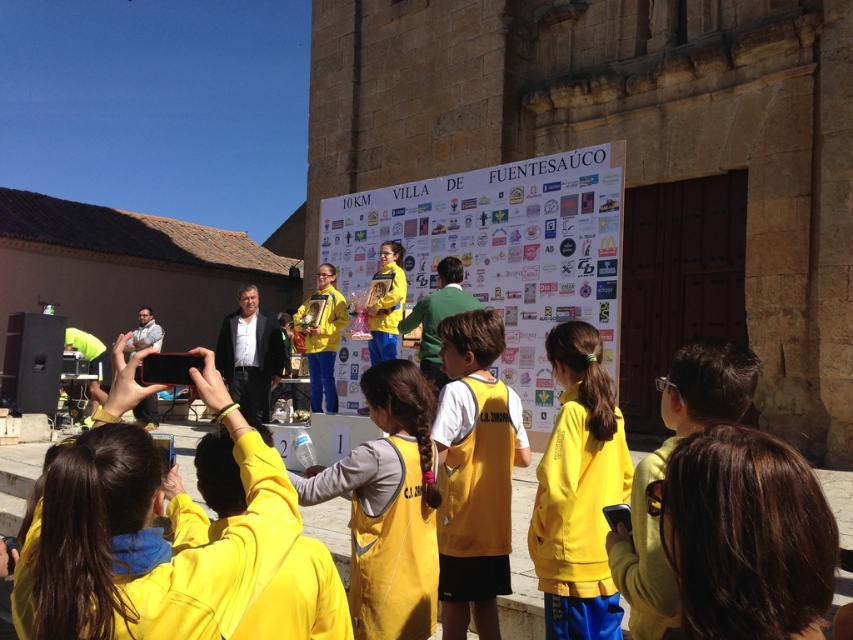
You are a photographer at the event and want to arrange the yellow fabric jacket at center and the yellow matte jacket at center so that both are visible in the photo. Which jacket should be placed in front to ensure the taller one is not blocked?

The yellow fabric jacket at center is not as tall as the yellow matte jacket at center, so to ensure the taller jacket is not blocked, the shorter yellow fabric jacket at center should be placed in front.

You are standing in front of the historic stone building and want to take a photo of both the point at coordinates [563,328] and the point at coordinates [624,532]. Which point is closer to your camera when you take the photo?

Point [624,532] is closer to the camera because it is less further away than point [563,328].